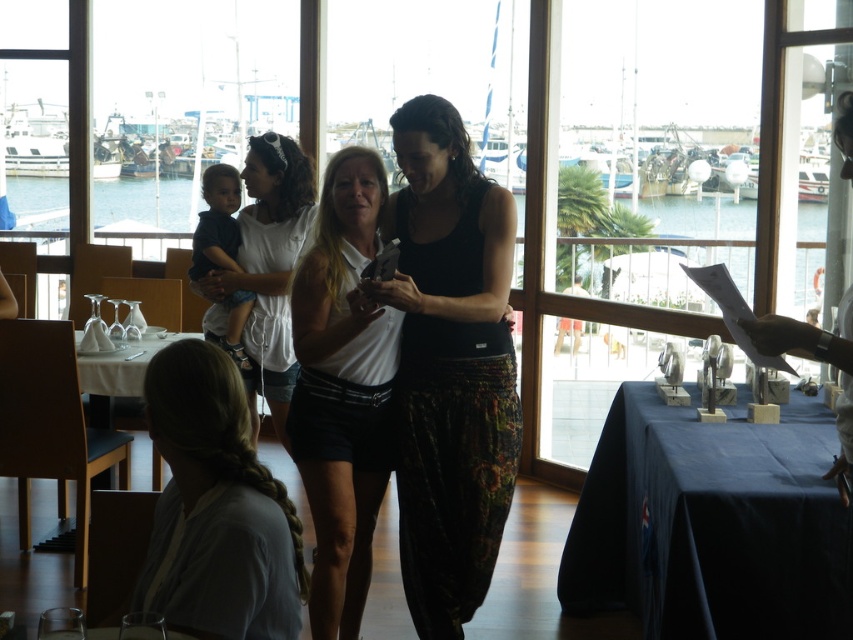
You are a fashion designer observing the scene. You need to determine which item of clothing has a larger size between the white matte shorts at center and the light gray cotton shirt at lower left. Based on the description, which one is bigger?

The white matte shorts at center is bigger than the light gray cotton shirt at lower left according to the description.

You are a server in a restaurant and need to place a 12 inch tall drink on the table. The table is the blue fabric table at lower right. The woman in the black matte tank top at center is standing next to it. Can the table support the drink without it touching her?

The blue fabric table at lower right has a lesser height compared to black matte tank top at center, meaning the table is shorter. Since the drink is 12 inches tall, placing it on the table may cause it to be at a height that could potentially touch the woman if she leans over, but the exact clearance isn